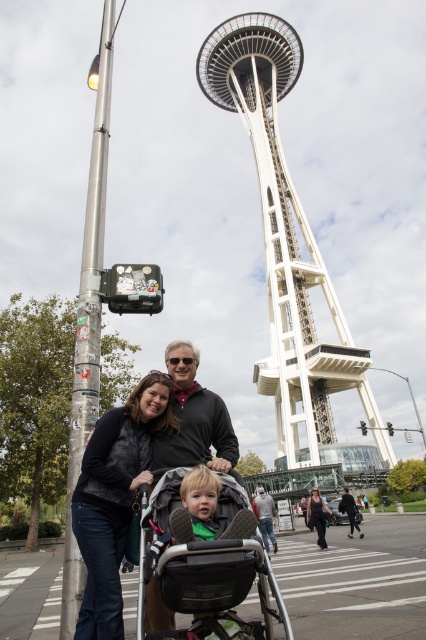
Question: Can you confirm if denim jacket at lower left is positioned to the left of light gray jeans at center?

Choices:
 (A) no
 (B) yes

Answer: (B)

Question: Which point is farther to the camera?

Choices:
 (A) (146, 380)
 (B) (262, 77)

Answer: (B)

Question: Which point is closer to the camera?

Choices:
 (A) [196, 481]
 (B) [198, 563]

Answer: (B)

Question: Which point is farther from the camera taking this photo?

Choices:
 (A) (207, 493)
 (B) (183, 502)

Answer: (A)

Question: Does black textured stroller at center appear over light gray jeans at center?

Choices:
 (A) yes
 (B) no

Answer: (A)

Question: Observing the image, what is the correct spatial positioning of white metallic space needle at center in reference to light gray jeans at center?

Choices:
 (A) above
 (B) below

Answer: (A)